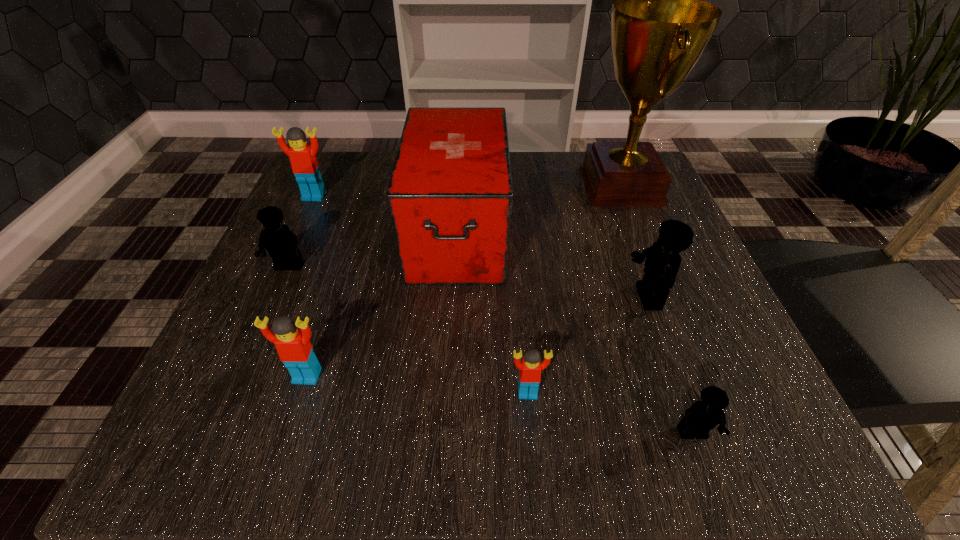
The width and height of the screenshot is (960, 540). Identify the location of the second biggest yellow Lego. (281, 243).

At what (x,y) coordinates should I click in order to perform the action: click on the nearest red Lego. Please return your answer as a coordinate pair (x, y). The image size is (960, 540). Looking at the image, I should click on (530, 367).

Where is `the fourth Lego from left to right`? the fourth Lego from left to right is located at coordinates (530, 367).

Image resolution: width=960 pixels, height=540 pixels. In order to click on the smallest yellow Lego in this screenshot , I will do `click(702, 416)`.

At what (x,y) coordinates should I click in order to perform the action: click on the nearest Lego. Please return your answer as a coordinate pair (x, y). The image size is (960, 540). Looking at the image, I should click on (702, 416).

You are a GUI agent. You are given a task and a screenshot of the screen. Output one action in this format:
    pyautogui.click(x=<x>, y=<y>)
    Task: Click on the vacant point located 0.290m on the plaque of the tallest object
    The height and width of the screenshot is (540, 960).
    Given the screenshot: What is the action you would take?
    pyautogui.click(x=445, y=185)

Where is `vacant space positioned on the plaque of the tallest object`? vacant space positioned on the plaque of the tallest object is located at coordinates (412, 185).

Find the location of `vacant region located 0.330m on the plaque of the tallest object`. vacant region located 0.330m on the plaque of the tallest object is located at coordinates click(426, 185).

The image size is (960, 540). I want to click on free space located 0.250m on the handle side of the first-aid kit, so click(446, 433).

At what (x,y) coordinates should I click in order to perform the action: click on vacant space located 0.380m on the face of the farthest red Lego. Please return your answer as a coordinate pair (x, y). This screenshot has width=960, height=540. Looking at the image, I should click on (240, 357).